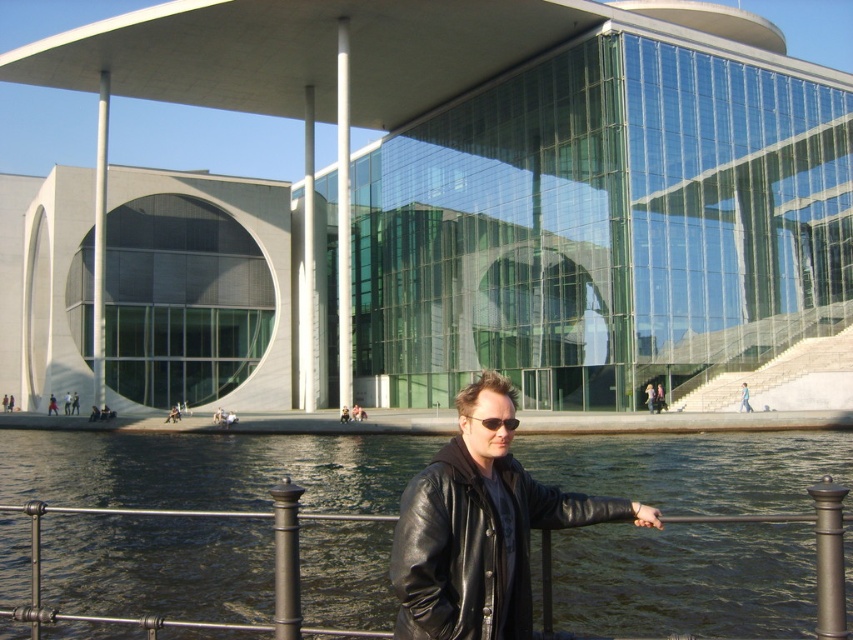
Question: Does glassy concrete building at center come behind black leather jacket at center?

Choices:
 (A) yes
 (B) no

Answer: (A)

Question: Can you confirm if dark green water at lower center is smaller than black leather jacket at center?

Choices:
 (A) no
 (B) yes

Answer: (A)

Question: Which point is farther to the camera?

Choices:
 (A) (111, 49)
 (B) (834, 456)
 (C) (416, 564)

Answer: (A)

Question: Does dark green water at lower center appear over black leather jacket at center?

Choices:
 (A) no
 (B) yes

Answer: (A)

Question: Which point is farther to the camera?

Choices:
 (A) (111, 208)
 (B) (755, 499)
 (C) (396, 628)

Answer: (A)

Question: Which point is closer to the camera?

Choices:
 (A) (151, 32)
 (B) (57, 550)
 (C) (397, 536)

Answer: (C)